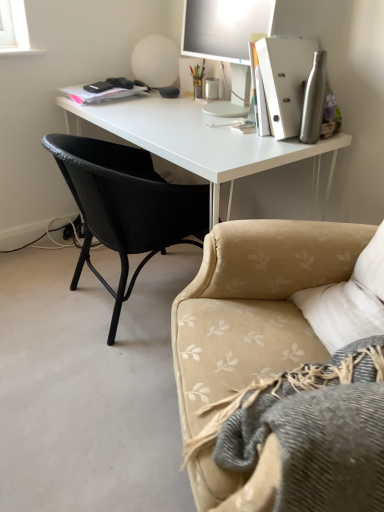
Question: From a real-world perspective, is black woven chair at left positioned above or below matte silver monitor at upper right?

Choices:
 (A) below
 (B) above

Answer: (A)

Question: From their relative heights in the image, would you say black woven chair at left is taller or shorter than matte silver monitor at upper right?

Choices:
 (A) tall
 (B) short

Answer: (A)

Question: Considering the real-world distances, which object is farthest from the white matte desk at center?

Choices:
 (A) beige floral fabric couch at lower right
 (B) matte silver monitor at upper right
 (C) silver metallic water bottle at right
 (D) black woven chair at left

Answer: (A)

Question: Considering the real-world distances, which object is farthest from the beige floral fabric couch at lower right?

Choices:
 (A) silver metallic water bottle at right
 (B) matte silver monitor at upper right
 (C) black woven chair at left
 (D) white matte desk at center

Answer: (B)